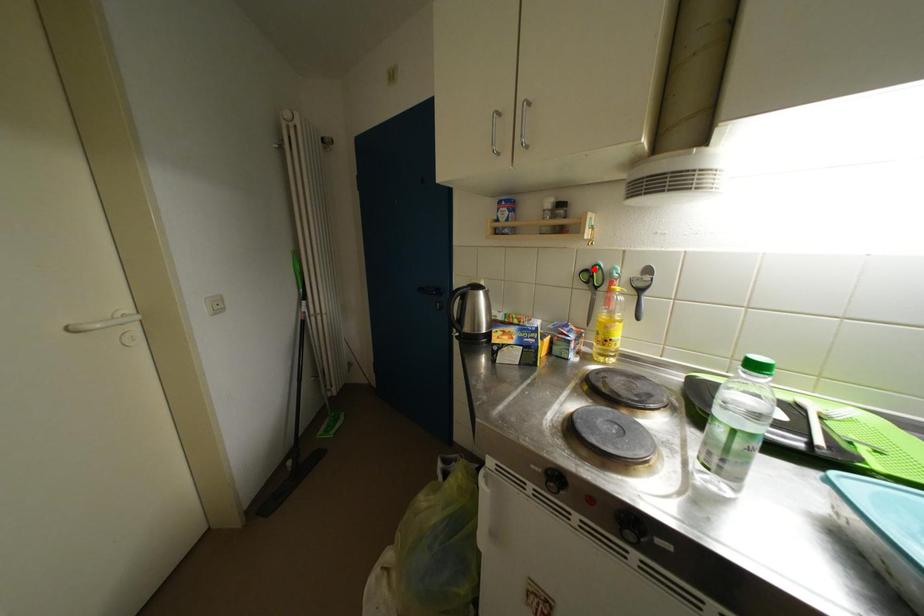
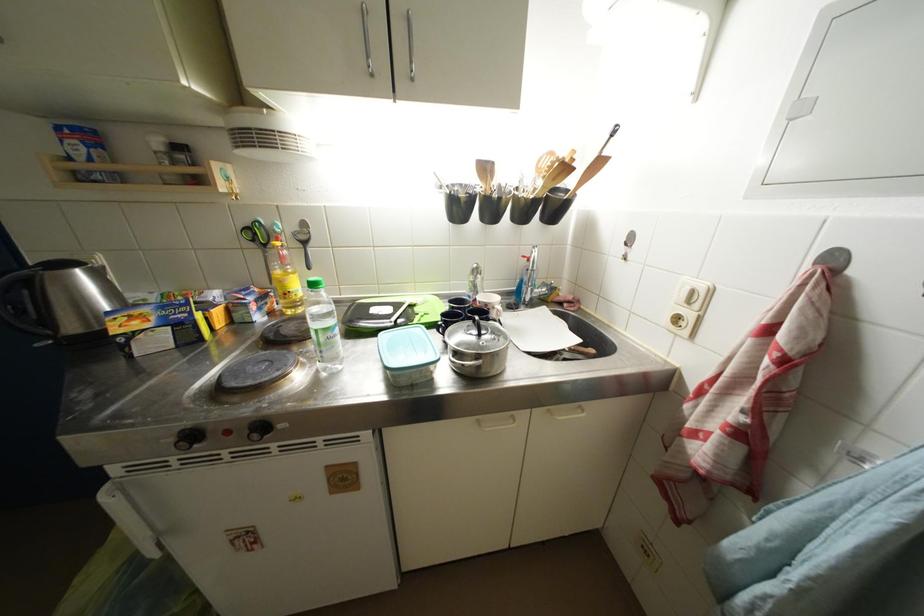
The point at the highlighted location is marked in the first image. Where is the corresponding point in the second image?

(253, 227)